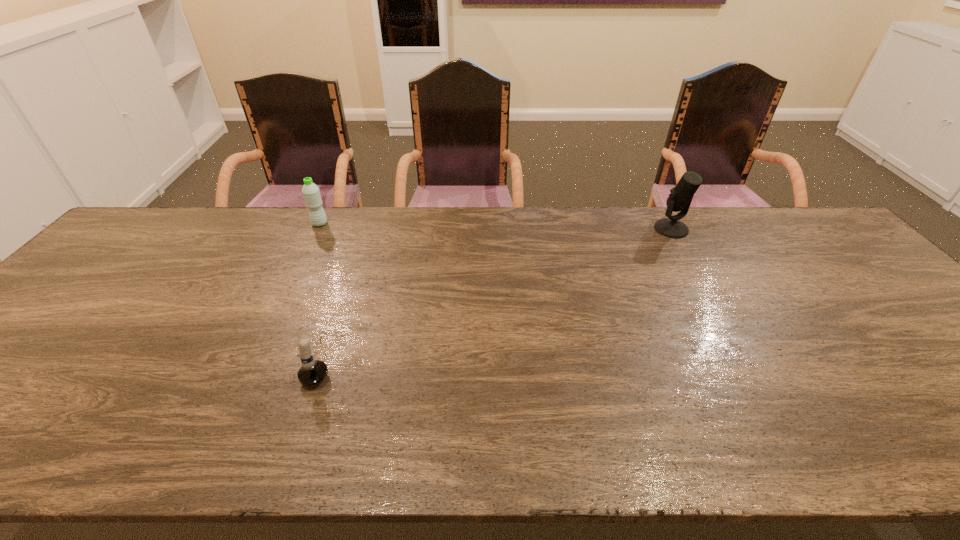
At what (x,y) coordinates should I click in order to perform the action: click on the tallest object. Please return your answer as a coordinate pair (x, y). Looking at the image, I should click on (681, 196).

Where is `the right microphone`? The width and height of the screenshot is (960, 540). the right microphone is located at coordinates (681, 196).

The height and width of the screenshot is (540, 960). What are the coordinates of `the second tallest object` in the screenshot? It's located at (312, 197).

Where is `water bottle`? The height and width of the screenshot is (540, 960). water bottle is located at coordinates (312, 197).

Find the location of a particular element. The image size is (960, 540). the nearest object is located at coordinates (312, 372).

You are a GUI agent. You are given a task and a screenshot of the screen. Output one action in this format:
    pyautogui.click(x=<x>, y=<y>)
    Task: Click on the second object from left to right
    This screenshot has width=960, height=540.
    Given the screenshot: What is the action you would take?
    pyautogui.click(x=312, y=372)

You are a GUI agent. You are given a task and a screenshot of the screen. Output one action in this format:
    pyautogui.click(x=<x>, y=<y>)
    Task: Click on the vacant space located 0.390m on the left of the tallest object
    The image size is (960, 540).
    Given the screenshot: What is the action you would take?
    pyautogui.click(x=533, y=229)

Where is `vacant space located on the front of the second tallest object`? vacant space located on the front of the second tallest object is located at coordinates (306, 251).

The image size is (960, 540). What are the coordinates of `vacant space located on the back of the nearest object` in the screenshot? It's located at (357, 253).

The height and width of the screenshot is (540, 960). I want to click on microphone located at the far edge, so click(x=681, y=196).